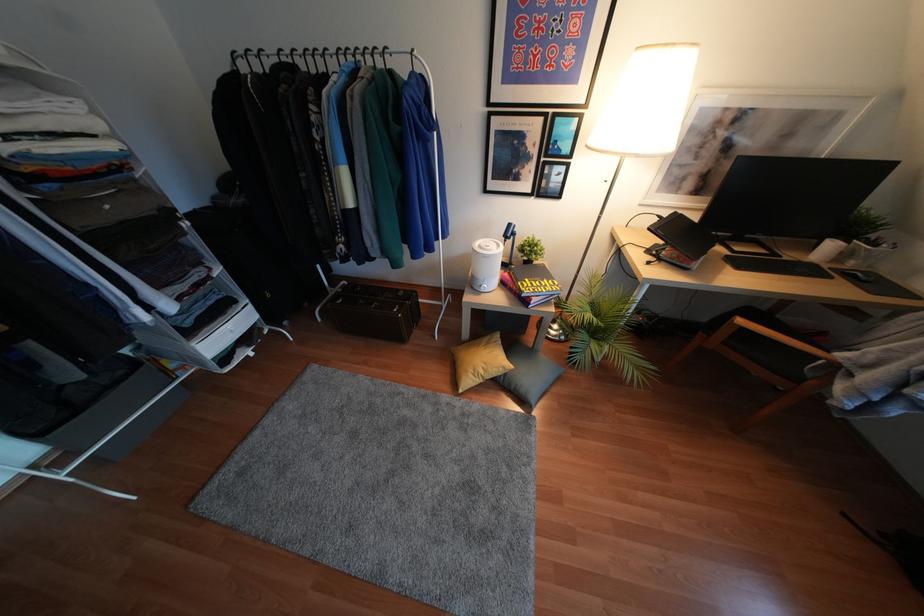
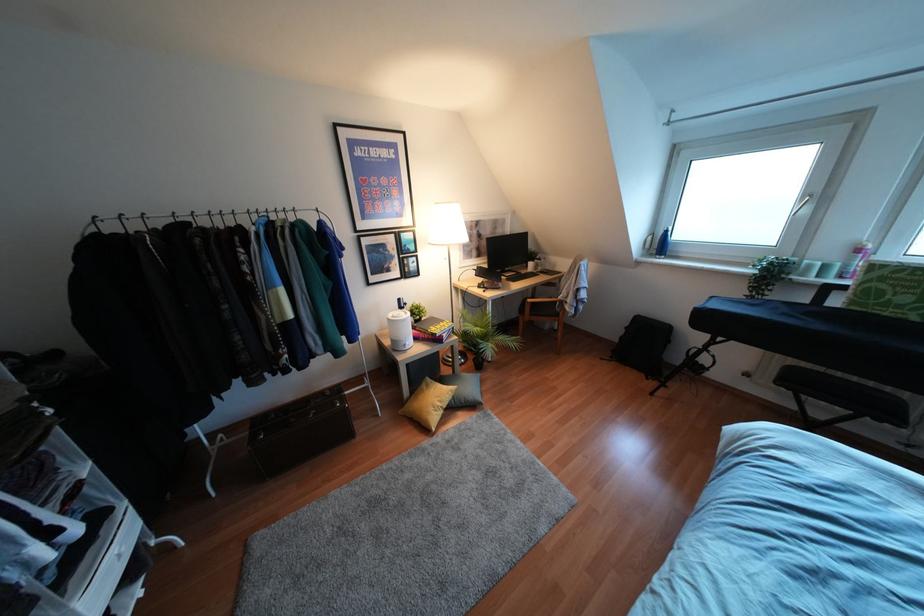
Where in the second image is the point corresponding to (x=648, y=249) from the first image?

(478, 286)